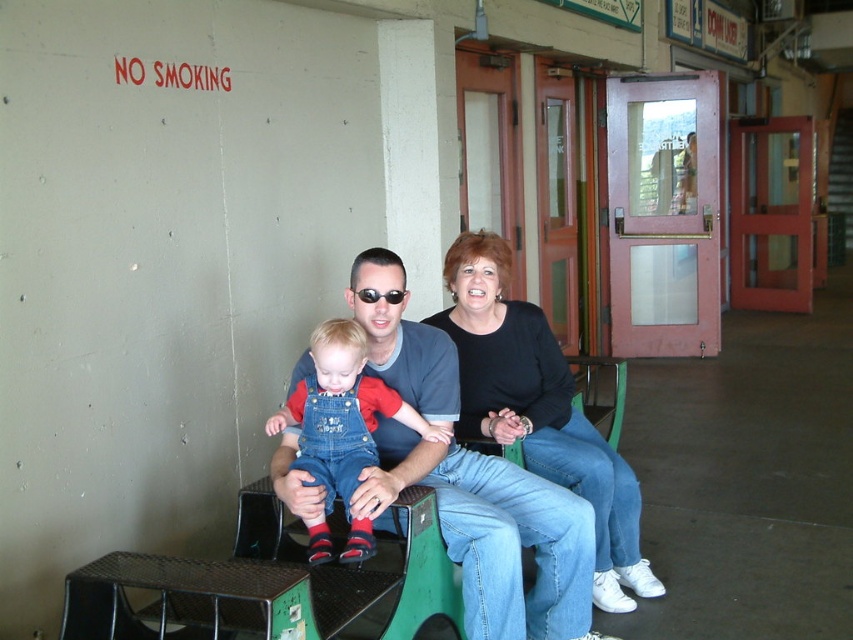
Does point (502, 634) come behind point (605, 492)?

No, (502, 634) is in front of (605, 492).

Locate an element on the screen. The width and height of the screenshot is (853, 640). matte blue jeans at center is located at coordinates (492, 534).

Image resolution: width=853 pixels, height=640 pixels. I want to click on matte blue jeans at center, so click(x=492, y=534).

Does point (454, 516) come farther from viewer compared to point (370, 301)?

No.

Is matte blue jeans at center further to camera compared to black plastic sunglasses at center?

No, matte blue jeans at center is closer to the viewer.

Based on the photo, who is more forward, (485, 465) or (368, 296)?

Point (368, 296) is more forward.

The image size is (853, 640). In order to click on matte blue jeans at center in this screenshot , I will do `click(492, 534)`.

Does matte blue jeans at center have a lesser height compared to denim overalls at center?

Incorrect, matte blue jeans at center's height does not fall short of denim overalls at center's.

Is point (453, 525) in front of point (358, 387)?

No, (453, 525) is behind (358, 387).

The width and height of the screenshot is (853, 640). Find the location of `matte blue jeans at center`. matte blue jeans at center is located at coordinates (492, 534).